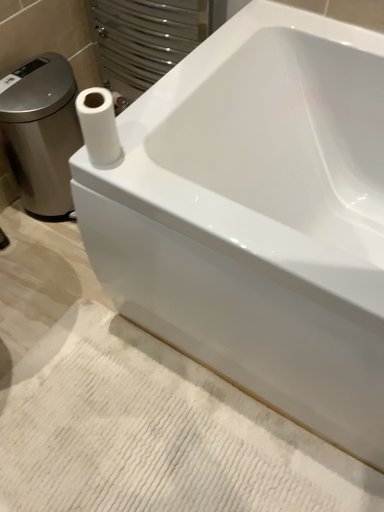
Question: From the image's perspective, is white glossy porcelain at left on top of white matte paper towel at upper left?

Choices:
 (A) no
 (B) yes

Answer: (B)

Question: From a real-world perspective, is white glossy porcelain at left physically above white matte paper towel at upper left?

Choices:
 (A) no
 (B) yes

Answer: (A)

Question: Are white glossy porcelain at left and white matte paper towel at upper left making contact?

Choices:
 (A) no
 (B) yes

Answer: (A)

Question: Is white glossy porcelain at left taller than white matte paper towel at upper left?

Choices:
 (A) no
 (B) yes

Answer: (B)

Question: From a real-world perspective, is white glossy porcelain at left beneath white matte paper towel at upper left?

Choices:
 (A) yes
 (B) no

Answer: (A)

Question: Is white textured bath mat at lower center taller or shorter than white matte paper towel at upper left?

Choices:
 (A) short
 (B) tall

Answer: (A)

Question: From the image's perspective, relative to white matte paper towel at upper left, is white textured bath mat at lower center above or below?

Choices:
 (A) below
 (B) above

Answer: (A)

Question: Visually, is white textured bath mat at lower center positioned to the left or to the right of white matte paper towel at upper left?

Choices:
 (A) right
 (B) left

Answer: (A)

Question: Based on their sizes in the image, would you say white textured bath mat at lower center is bigger or smaller than white matte paper towel at upper left?

Choices:
 (A) big
 (B) small

Answer: (A)

Question: Is white textured bath mat at lower center to the left or to the right of white glossy porcelain at left in the image?

Choices:
 (A) left
 (B) right

Answer: (B)

Question: Is white textured bath mat at lower center in front of or behind white glossy porcelain at left in the image?

Choices:
 (A) behind
 (B) front

Answer: (B)

Question: From their relative heights in the image, would you say white textured bath mat at lower center is taller or shorter than white glossy porcelain at left?

Choices:
 (A) short
 (B) tall

Answer: (A)

Question: From a real-world perspective, is white textured bath mat at lower center above or below white glossy porcelain at left?

Choices:
 (A) below
 (B) above

Answer: (A)

Question: From the image's perspective, is white glossy porcelain at left above or below white textured bath mat at lower center?

Choices:
 (A) below
 (B) above

Answer: (B)

Question: From a real-world perspective, is white glossy porcelain at left above or below white textured bath mat at lower center?

Choices:
 (A) below
 (B) above

Answer: (B)